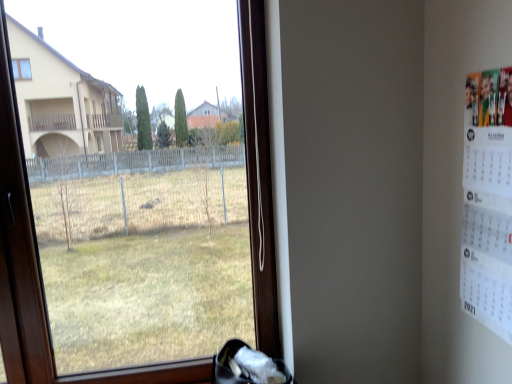
Question: Is point (269, 208) closer or farther from the camera than point (486, 286)?

Choices:
 (A) farther
 (B) closer

Answer: (A)

Question: From the image's perspective, relative to white paper calendar at right, is transparent glass window at center above or below?

Choices:
 (A) below
 (B) above

Answer: (A)

Question: Which is nearer to the white fabric shoe at lower center?

Choices:
 (A) white paper calendar at right
 (B) transparent glass window at center

Answer: (A)

Question: Which of these objects is positioned farthest from the white fabric shoe at lower center?

Choices:
 (A) transparent glass window at center
 (B) white paper calendar at right

Answer: (A)